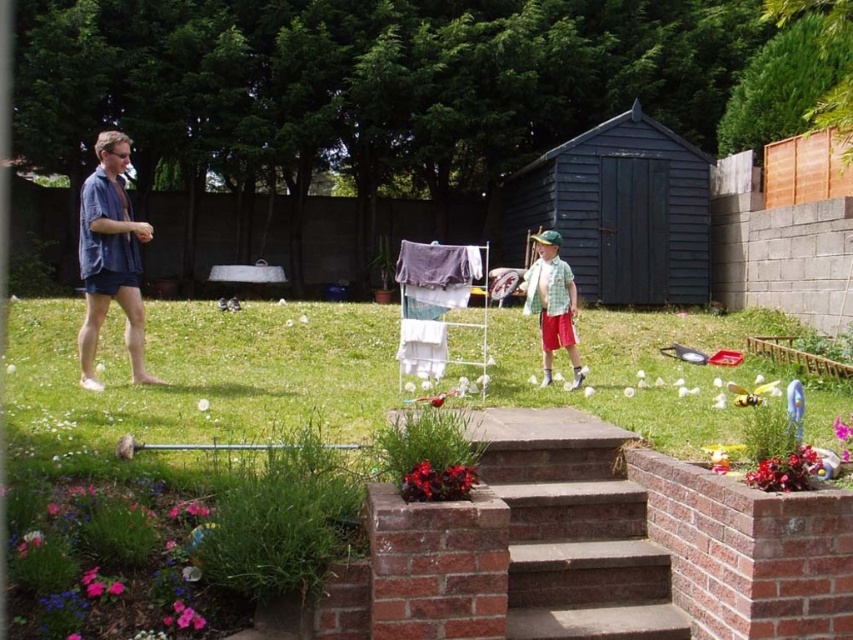
Question: Can you confirm if brown concrete stairs at center is positioned above blue cotton shorts at left?

Choices:
 (A) yes
 (B) no

Answer: (B)

Question: Among these objects, which one is nearest to the camera?

Choices:
 (A) checkered fabric shirt at center
 (B) blue cotton shorts at left

Answer: (B)

Question: Can you confirm if brown concrete stairs at center is bigger than blue cotton shorts at left?

Choices:
 (A) no
 (B) yes

Answer: (A)

Question: Which point appears closest to the camera in this image?

Choices:
 (A) (401, 273)
 (B) (57, 376)
 (C) (538, 515)

Answer: (C)

Question: Which point is farther to the camera?

Choices:
 (A) (410, 353)
 (B) (813, 433)
 (C) (532, 308)

Answer: (C)

Question: In this image, where is brick planter at lower center located relative to blue cotton shorts at left?

Choices:
 (A) right
 (B) left

Answer: (A)